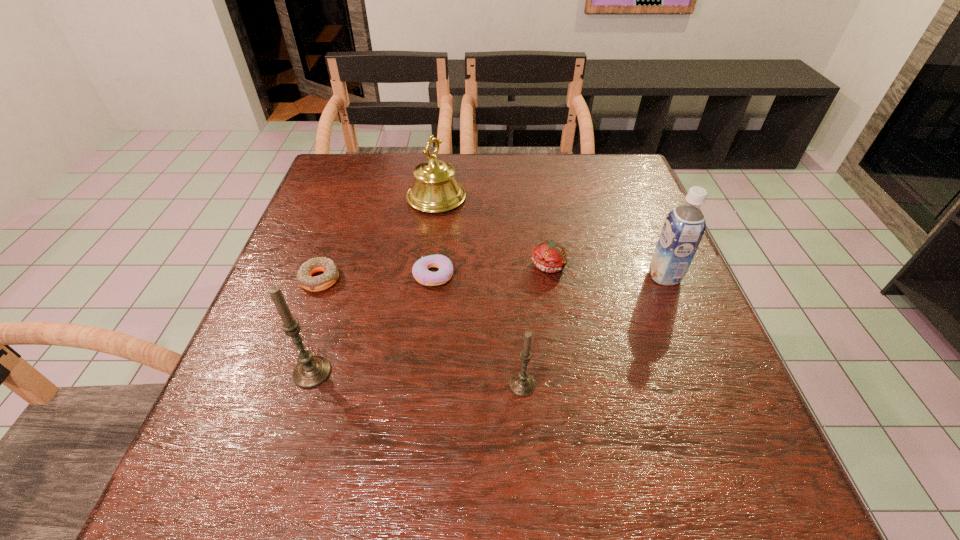
What are the coordinates of `object that is the closest one to the right candle` in the screenshot? It's located at (420, 271).

What are the coordinates of `object identified as the second closest to the rightmost object` in the screenshot? It's located at (521, 384).

You are a GUI agent. You are given a task and a screenshot of the screen. Output one action in this format:
    pyautogui.click(x=<x>, y=<y>)
    Task: Click on the vacant area in the image that satisfies the following two spatial constraints: 1. on the front side of the right candle; 2. on the left side of the farthest object
    
    Given the screenshot: What is the action you would take?
    pyautogui.click(x=414, y=385)